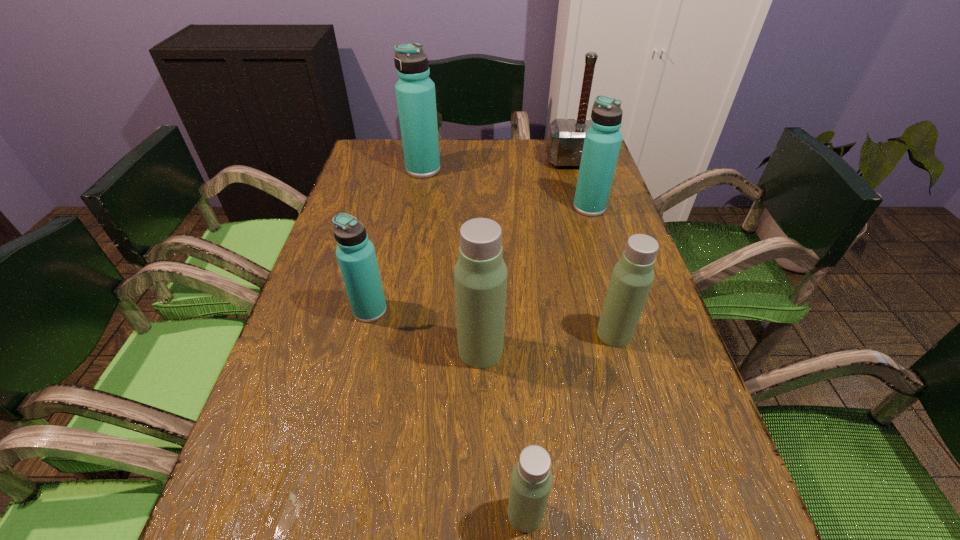
Identify the location of object at the far left corner. Image resolution: width=960 pixels, height=540 pixels. (415, 91).

Identify the location of object that is at the far right corner. The width and height of the screenshot is (960, 540). click(x=565, y=140).

You are a GUI agent. You are given a task and a screenshot of the screen. Output one action in this format:
    pyautogui.click(x=<x>, y=<y>)
    Task: Click on the vacant region at the far edge of the desktop
    The width and height of the screenshot is (960, 540).
    Given the screenshot: What is the action you would take?
    pyautogui.click(x=459, y=167)

Identify the location of free space at the left edge of the desktop. (391, 190).

Locate an element on the screen. vacant space at the right edge of the desktop is located at coordinates (658, 519).

Where is `free space between the tallest thermos bottle and the biggest light thermos bottle`? The width and height of the screenshot is (960, 540). free space between the tallest thermos bottle and the biggest light thermos bottle is located at coordinates (452, 260).

Image resolution: width=960 pixels, height=540 pixels. What are the coordinates of `free area in between the tallest thermos bottle and the rightmost aqua thermos bottle` in the screenshot? It's located at (506, 188).

Locate an element on the screen. Image resolution: width=960 pixels, height=540 pixels. empty space that is in between the second farthest thermos bottle and the tallest thermos bottle is located at coordinates (506, 188).

Identify the location of free spot between the nearest aqua thermos bottle and the nearest object. (447, 412).

The height and width of the screenshot is (540, 960). In order to click on unoccupied position between the second biggest light thermos bottle and the biggest light thermos bottle in this screenshot , I will do `click(547, 342)`.